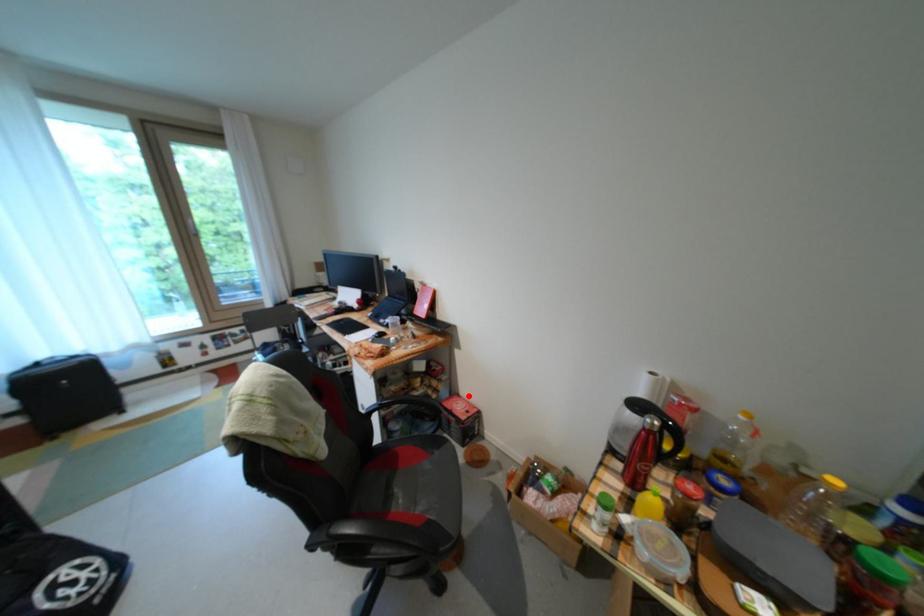
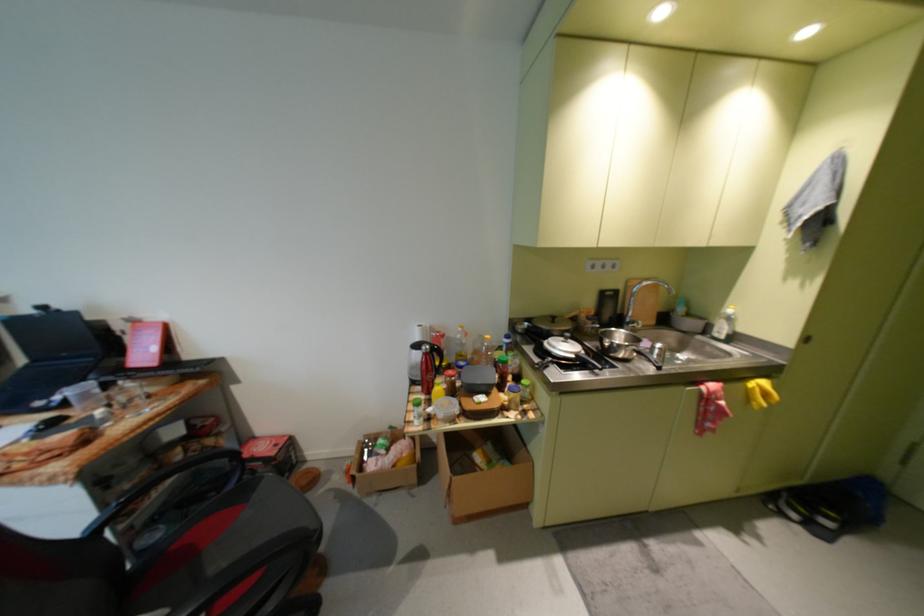
Question: I am providing you with two images of the same scene from different viewpoints. In image1, a red point is highlighted. Considering the same 3D point in image2, which of the following is correct?

Choices:
 (A) It is closer
 (B) It is farther

Answer: (A)